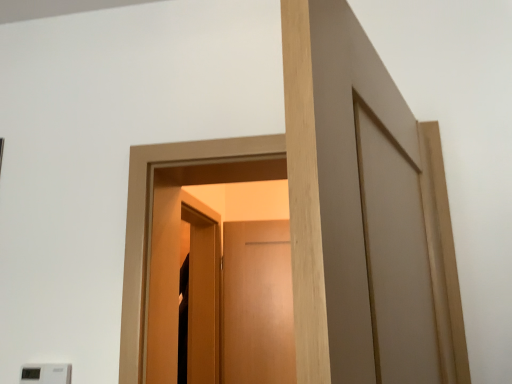
Find the location of a particular element. Image resolution: width=512 pixels, height=384 pixels. matte wood screen door at center is located at coordinates (203, 297).

This screenshot has width=512, height=384. Describe the element at coordinates (203, 297) in the screenshot. I see `matte wood screen door at center` at that location.

Measure the distance between point (48, 376) and camera.

1.24 meters.

The image size is (512, 384). What are the coordinates of `white plastic light switch at lower left` in the screenshot? It's located at (46, 373).

The width and height of the screenshot is (512, 384). Describe the element at coordinates (46, 373) in the screenshot. I see `white plastic light switch at lower left` at that location.

Image resolution: width=512 pixels, height=384 pixels. Find the location of `matte wood screen door at center`. matte wood screen door at center is located at coordinates (203, 297).

Between matte wood screen door at center and white plastic light switch at lower left, which one appears on the left side from the viewer's perspective?

Positioned to the left is white plastic light switch at lower left.

Considering the positions of objects matte wood screen door at center and white plastic light switch at lower left in the image provided, who is in front, matte wood screen door at center or white plastic light switch at lower left?

white plastic light switch at lower left is closer to the camera.

Is point (204, 275) less distant than point (54, 376)?

No, it is not.

From the image's perspective, would you say matte wood screen door at center is shown under white plastic light switch at lower left?

Yes, from the image's perspective, matte wood screen door at center is below white plastic light switch at lower left.

From a real-world perspective, is matte wood screen door at center on top of white plastic light switch at lower left?

Yes, from a real-world perspective, matte wood screen door at center is over white plastic light switch at lower left

Which object is thinner, matte wood screen door at center or white plastic light switch at lower left?

white plastic light switch at lower left is thinner.

Considering the sizes of objects matte wood screen door at center and white plastic light switch at lower left in the image provided, who is taller, matte wood screen door at center or white plastic light switch at lower left?

matte wood screen door at center is taller.

Can you confirm if matte wood screen door at center is smaller than white plastic light switch at lower left?

No.

Is white plastic light switch at lower left a part of matte wood screen door at center?

No.

Is matte wood screen door at center far away from white plastic light switch at lower left?

That's right, there is a large distance between matte wood screen door at center and white plastic light switch at lower left.

Does matte wood screen door at center turn towards white plastic light switch at lower left?

No, matte wood screen door at center does not turn towards white plastic light switch at lower left.

This screenshot has height=384, width=512. I want to click on screen door that appears below the white plastic light switch at lower left (from the image's perspective), so click(203, 297).

Does white plastic light switch at lower left appear on the right side of matte wood screen door at center?

Incorrect, white plastic light switch at lower left is not on the right side of matte wood screen door at center.

Considering their positions, is white plastic light switch at lower left located in front of or behind matte wood screen door at center?

white plastic light switch at lower left is in front of matte wood screen door at center.

Is point (37, 374) behind point (199, 256)?

No, (37, 374) is in front of (199, 256).

From the image's perspective, which is above, white plastic light switch at lower left or matte wood screen door at center?

From the image's view, white plastic light switch at lower left is above.

From a real-world perspective, is white plastic light switch at lower left below matte wood screen door at center?

Correct, in the physical world, white plastic light switch at lower left is lower than matte wood screen door at center.

Can you confirm if white plastic light switch at lower left is thinner than matte wood screen door at center?

Yes, white plastic light switch at lower left is thinner than matte wood screen door at center.

Is white plastic light switch at lower left shorter than matte wood screen door at center?

Correct, white plastic light switch at lower left is not as tall as matte wood screen door at center.

Based on their sizes in the image, would you say white plastic light switch at lower left is bigger or smaller than matte wood screen door at center?

Considering their sizes, white plastic light switch at lower left takes up less space than matte wood screen door at center.

Which is correct: white plastic light switch at lower left is inside matte wood screen door at center, or outside of it?

white plastic light switch at lower left cannot be found inside matte wood screen door at center.

Is white plastic light switch at lower left not close to matte wood screen door at center?

Yes, white plastic light switch at lower left and matte wood screen door at center are quite far apart.

Does white plastic light switch at lower left turn towards matte wood screen door at center?

No, white plastic light switch at lower left is not oriented towards matte wood screen door at center.

How different are the orientations of white plastic light switch at lower left and matte wood screen door at center in degrees?

There is a 0.0526-degree angle between the facing directions of white plastic light switch at lower left and matte wood screen door at center.

Measure the distance from white plastic light switch at lower left to matte wood screen door at center.

white plastic light switch at lower left and matte wood screen door at center are 4.24 feet apart.

What are the coordinates of `light switch in front of the matte wood screen door at center` in the screenshot? It's located at (46, 373).

Where is `screen door behind the white plastic light switch at lower left`? screen door behind the white plastic light switch at lower left is located at coordinates (203, 297).

This screenshot has width=512, height=384. Find the location of `light switch directly beneath the matte wood screen door at center (from a real-world perspective)`. light switch directly beneath the matte wood screen door at center (from a real-world perspective) is located at coordinates (46, 373).